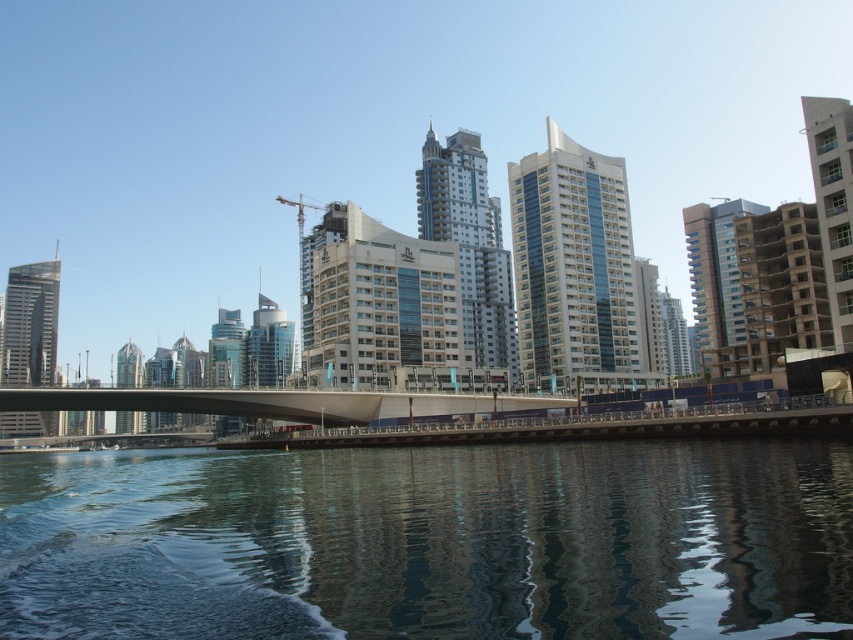
Looking at this image, can you confirm if glassy blue skyscraper at center is positioned to the left of glassy blue skyscraper at left?

Incorrect, glassy blue skyscraper at center is not on the left side of glassy blue skyscraper at left.

Is glassy blue skyscraper at center thinner than glassy blue skyscraper at left?

Indeed, glassy blue skyscraper at center has a lesser width compared to glassy blue skyscraper at left.

The width and height of the screenshot is (853, 640). What are the coordinates of `glassy blue skyscraper at center` in the screenshot? It's located at (573, 269).

Identify the location of glassy blue skyscraper at center. (573, 269).

Does beige concrete building at right have a lesser height compared to glassy blue skyscraper at left?

No.

Is beige concrete building at right above glassy blue skyscraper at left?

Yes, beige concrete building at right is above glassy blue skyscraper at left.

Is point (737, 305) positioned behind point (126, 378)?

No.

Locate an element on the screen. beige concrete building at right is located at coordinates (717, 284).

Does transparent water at lower center appear on the right side of beige concrete building at right?

No, transparent water at lower center is not to the right of beige concrete building at right.

Which of these two, transparent water at lower center or beige concrete building at right, stands taller?

Standing taller between the two is beige concrete building at right.

Find the location of `transparent water at lower center`. transparent water at lower center is located at coordinates (431, 541).